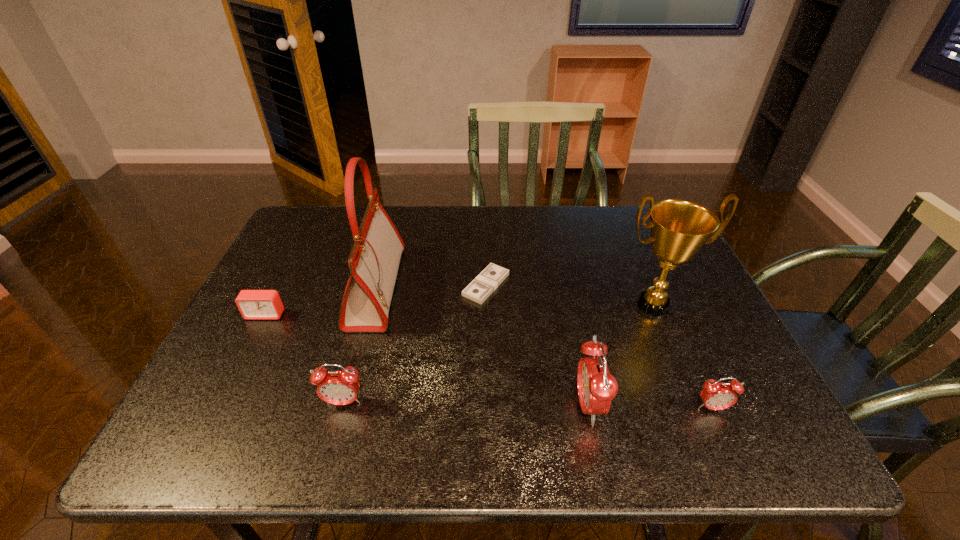
The image size is (960, 540). I want to click on the second alarm clock from left to right, so click(336, 387).

The height and width of the screenshot is (540, 960). I want to click on the fourth tallest object, so click(x=336, y=387).

Find the location of `the second alarm clock from right to left`. the second alarm clock from right to left is located at coordinates coord(596,386).

The image size is (960, 540). In order to click on the third object from right to left in this screenshot , I will do `click(596, 386)`.

At what (x,y) coordinates should I click in order to perform the action: click on the second shortest alarm clock. Please return your answer as a coordinate pair (x, y). The width and height of the screenshot is (960, 540). Looking at the image, I should click on (715, 395).

You are a GUI agent. You are given a task and a screenshot of the screen. Output one action in this format:
    pyautogui.click(x=<x>, y=<y>)
    Task: Click on the third shortest object
    This screenshot has width=960, height=540.
    Given the screenshot: What is the action you would take?
    pyautogui.click(x=715, y=395)

I want to click on the fourth object from left to right, so click(492, 276).

This screenshot has width=960, height=540. I want to click on the shortest object, so click(492, 276).

Locate an element on the screen. This screenshot has width=960, height=540. the shortest alarm clock is located at coordinates (253, 304).

Find the location of a particular element. the leftmost object is located at coordinates (253, 304).